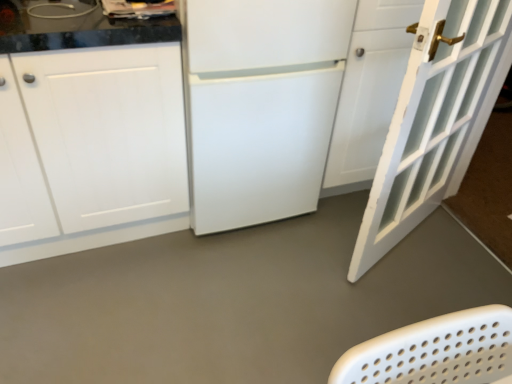
Question: Can you confirm if white painted wood door at right is thinner than white matte refrigerator at center?

Choices:
 (A) yes
 (B) no

Answer: (A)

Question: Can you confirm if white painted wood door at right is taller than white matte refrigerator at center?

Choices:
 (A) no
 (B) yes

Answer: (B)

Question: Is white painted wood door at right smaller than white matte refrigerator at center?

Choices:
 (A) yes
 (B) no

Answer: (A)

Question: Is white painted wood door at right beside white matte refrigerator at center?

Choices:
 (A) no
 (B) yes

Answer: (A)

Question: Does white painted wood door at right have a greater width compared to white matte refrigerator at center?

Choices:
 (A) yes
 (B) no

Answer: (B)

Question: Does white painted wood door at right have a lesser height compared to white matte refrigerator at center?

Choices:
 (A) yes
 (B) no

Answer: (B)

Question: Is white matte refrigerator at center completely or partially inside white matte cabinet at left?

Choices:
 (A) no
 (B) yes

Answer: (A)

Question: Can you confirm if white matte cabinet at left is shorter than white matte refrigerator at center?

Choices:
 (A) yes
 (B) no

Answer: (A)

Question: Considering the relative sizes of white matte cabinet at left and white matte refrigerator at center in the image provided, is white matte cabinet at left thinner than white matte refrigerator at center?

Choices:
 (A) no
 (B) yes

Answer: (B)

Question: Does white matte cabinet at left touch white matte refrigerator at center?

Choices:
 (A) yes
 (B) no

Answer: (B)

Question: From the image's perspective, is white matte cabinet at left beneath white matte refrigerator at center?

Choices:
 (A) yes
 (B) no

Answer: (A)

Question: Can you confirm if white matte cabinet at left is positioned to the left of white matte refrigerator at center?

Choices:
 (A) no
 (B) yes

Answer: (B)

Question: Is white matte cabinet at left positioned beyond the bounds of white painted wood door at right?

Choices:
 (A) yes
 (B) no

Answer: (A)